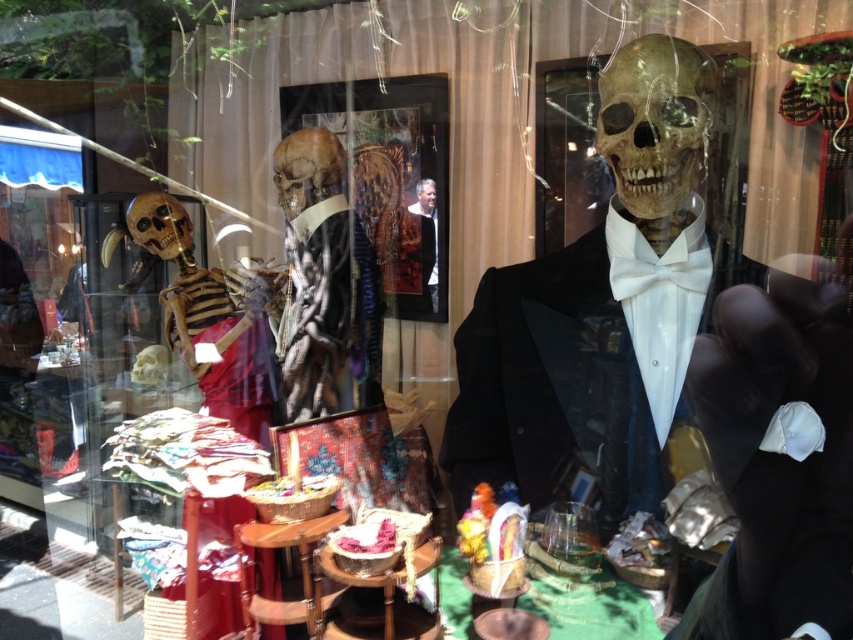
You are a customer standing in front of the storefront window. You see a point marked at coordinates (x=323, y=284). What object is located at that point?

The matte brown skeleton at center is located at point 0.444, 0.481.

You are a customer looking at the storefront window display. You see the matte brown skeleton at center and the smooth beige skull at center. Which one is positioned to the left?

The matte brown skeleton at center is positioned to the left of the smooth beige skull at center.

You are a costume designer preparing for a Halloween show. You need to place a small accessory on top of the taller object between the brown matte skull at center and the smooth leather jacket at center. Which object should you choose?

The smooth leather jacket at center is taller than the brown matte skull at center, so you should place the accessory on top of the smooth leather jacket at center.